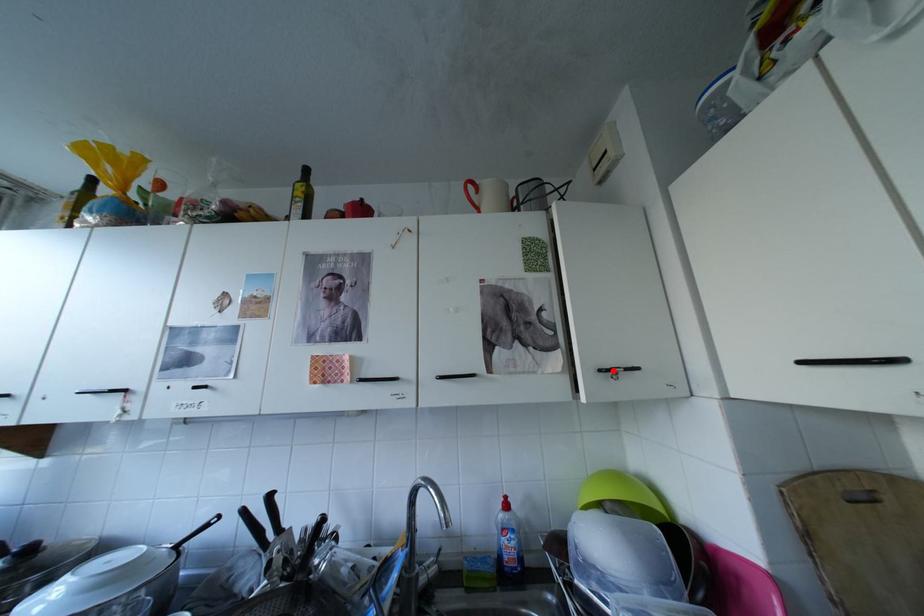
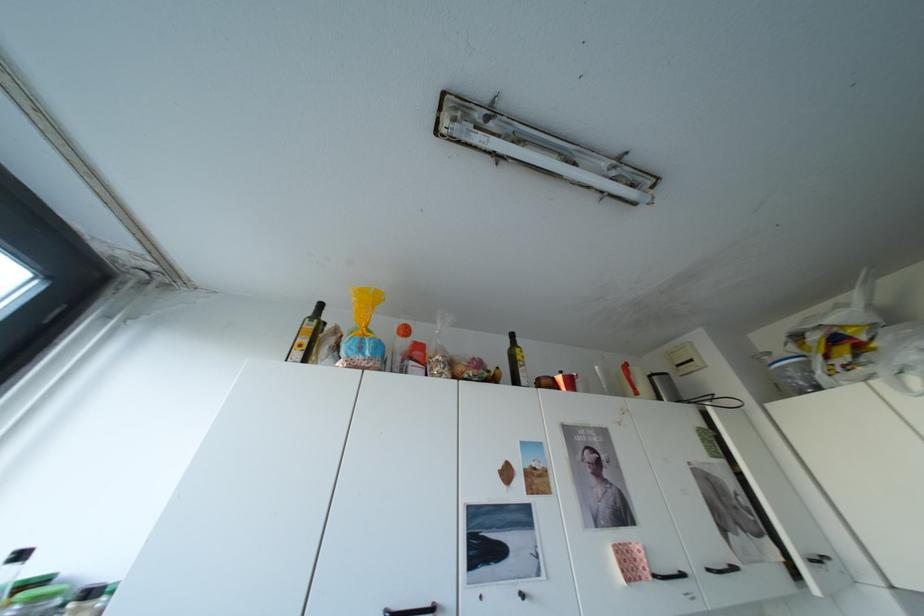
Question: I am providing you with two images of the same scene from different viewpoints. A red point is marked on the first image. Can you still see the location of the red point in image 2?

Choices:
 (A) Yes
 (B) No

Answer: (A)